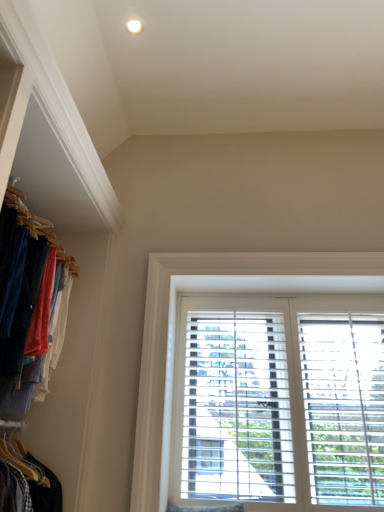
Question: In the image, is matte wooden hangers at left on the left side or the right side of white wooden blinds at center?

Choices:
 (A) right
 (B) left

Answer: (B)

Question: From a real-world perspective, is matte wooden hangers at left above or below white wooden blinds at center?

Choices:
 (A) above
 (B) below

Answer: (A)

Question: Based on their sizes in the image, would you say matte wooden hangers at left is bigger or smaller than white wooden blinds at center?

Choices:
 (A) small
 (B) big

Answer: (B)

Question: Relative to matte wooden hangers at left, is white wooden blinds at center in front or behind?

Choices:
 (A) behind
 (B) front

Answer: (A)

Question: Is point coord(144,473) positioned closer to the camera than point coord(11,335)?

Choices:
 (A) closer
 (B) farther

Answer: (B)

Question: From a real-world perspective, is white wooden blinds at center above or below matte wooden hangers at left?

Choices:
 (A) above
 (B) below

Answer: (B)

Question: Visually, is white wooden blinds at center positioned to the left or to the right of matte wooden hangers at left?

Choices:
 (A) left
 (B) right

Answer: (B)